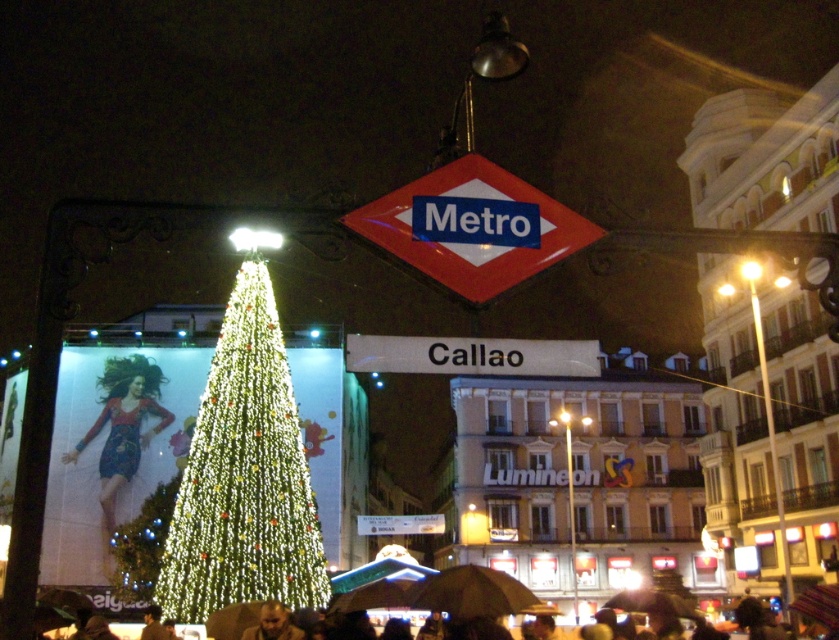
Question: Where is white plastic sign at center located in relation to smooth skin face at lower center in the image?

Choices:
 (A) right
 (B) left

Answer: (A)

Question: From the image, what is the correct spatial relationship of dark brown leather umbrella at lower center in relation to smooth skin face at lower center?

Choices:
 (A) above
 (B) below

Answer: (B)

Question: Based on their relative distances, which object is nearer to the smooth skin face at lower center?

Choices:
 (A) white plastic sign at center
 (B) illuminated green christmas tree at center
 (C) metallic diamond-shaped sign at center

Answer: (B)

Question: Does metallic diamond-shaped sign at center appear over dark brown leather umbrella at lower center?

Choices:
 (A) no
 (B) yes

Answer: (B)

Question: Which point appears farthest from the camera in this image?

Choices:
 (A) (534, 260)
 (B) (256, 547)

Answer: (B)

Question: Estimate the real-world distances between objects in this image. Which object is closer to the dark brown leather umbrella at lower center?

Choices:
 (A) matte blue dress at left
 (B) smooth skin face at lower center

Answer: (B)